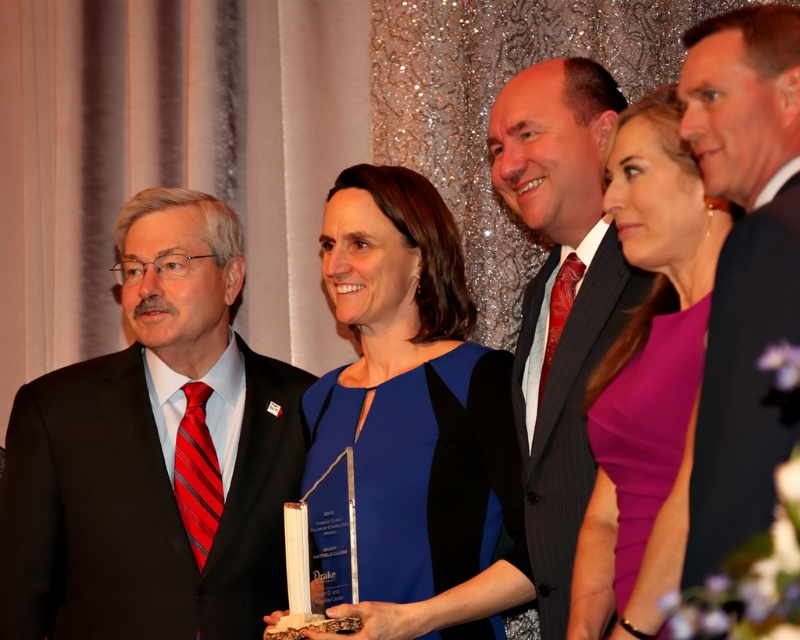
Is purple satin dress at center wider than shiny black suit at center?

In fact, purple satin dress at center might be narrower than shiny black suit at center.

Between purple satin dress at center and shiny black suit at center, which one is positioned higher?

shiny black suit at center is above.

Does point (609, 449) come in front of point (576, 202)?

That is True.

Locate an element on the screen. This screenshot has width=800, height=640. purple satin dress at center is located at coordinates (646, 374).

From the picture: Does matte black suit at left have a greater height compared to shiny black suit at center?

No.

Is matte black suit at left to the right of shiny black suit at center from the viewer's perspective?

No, matte black suit at left is not to the right of shiny black suit at center.

Which is behind, point (160, 448) or point (505, 182)?

Point (160, 448)

In order to click on matte black suit at left in this screenshot , I will do `click(154, 454)`.

Is blue satin dress at center smaller than black suit at right?

Actually, blue satin dress at center might be larger than black suit at right.

Does blue satin dress at center have a larger size compared to black suit at right?

Indeed, blue satin dress at center has a larger size compared to black suit at right.

Which is behind, point (504, 499) or point (708, 145)?

Point (504, 499)

Locate an element on the screen. blue satin dress at center is located at coordinates (412, 424).